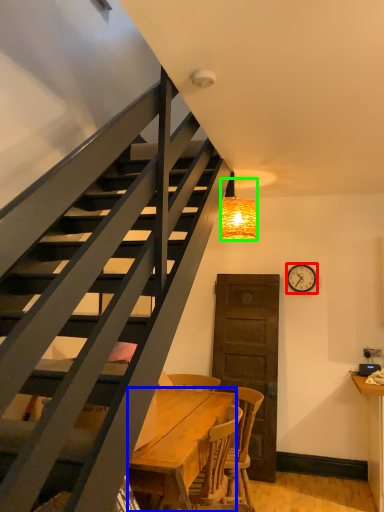
Question: Which object is positioned closest to clock (highlighted by a red box)? Select from desk (highlighted by a blue box) and lamp (highlighted by a green box).

Choices:
 (A) desk
 (B) lamp

Answer: (B)